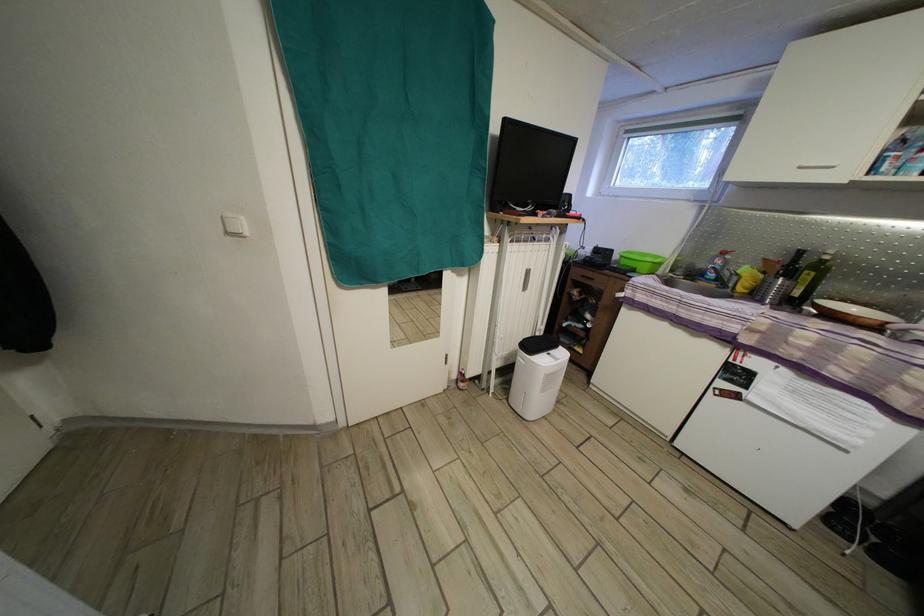
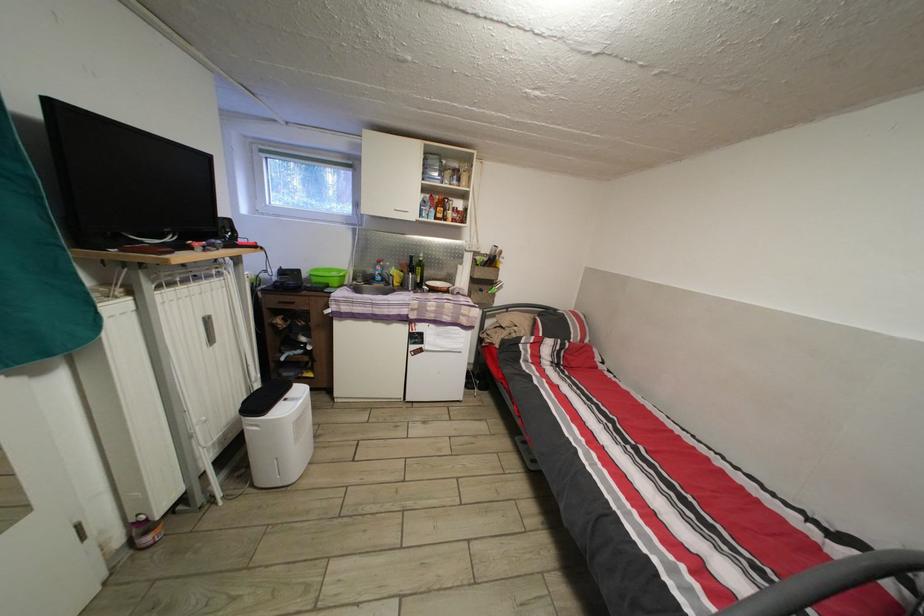
The point at (742,285) is marked in the first image. Where is the corresponding point in the second image?

(398, 285)